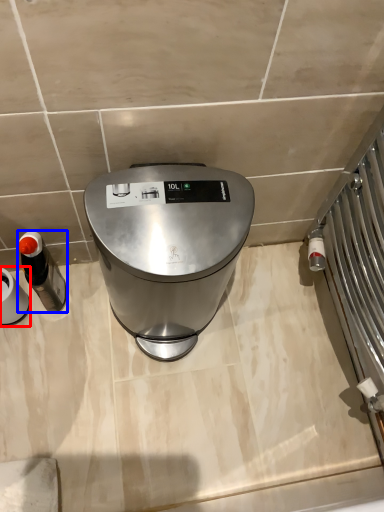
Question: Among these objects, which one is farthest to the camera, appliance (highlighted by a red box) or appliance (highlighted by a blue box)?

Choices:
 (A) appliance
 (B) appliance

Answer: (B)